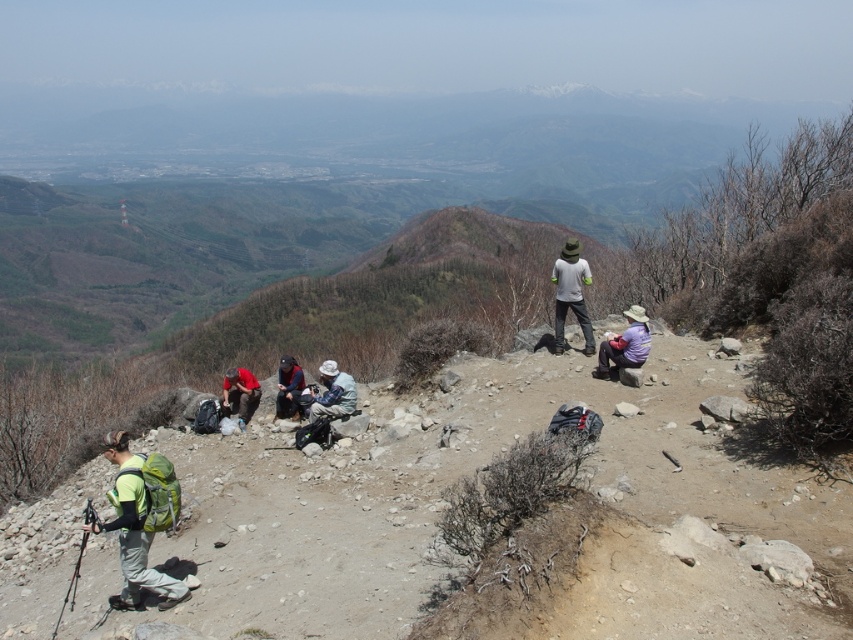
You are a hiker who wants to choose a hat that covers more of your face from the sun. Which hat between the purple fabric hat at lower right and the light gray fabric hat at center would you pick?

The light gray fabric hat at center has a greater width compared to the purple fabric hat at lower right, so you should pick the light gray fabric hat at center to cover more of your face from the sun.

You are a hiker who needs to locate your green fabric backpack at lower left. According to the coordinates provided, where exactly should you look on the image?

The green fabric backpack at lower left is located at the coordinates point (132, 529).

Consider the image. You are a hiker who wants to take a photo of the light gray fabric jacket at upper center and the red fabric shirt at center. Which one should you focus on first to ensure both are in the same frame?

The light gray fabric jacket at upper center is closer to the viewer than the red fabric shirt at center, so you should focus on the light gray fabric jacket at upper center first to ensure both are in focus and the same frame.